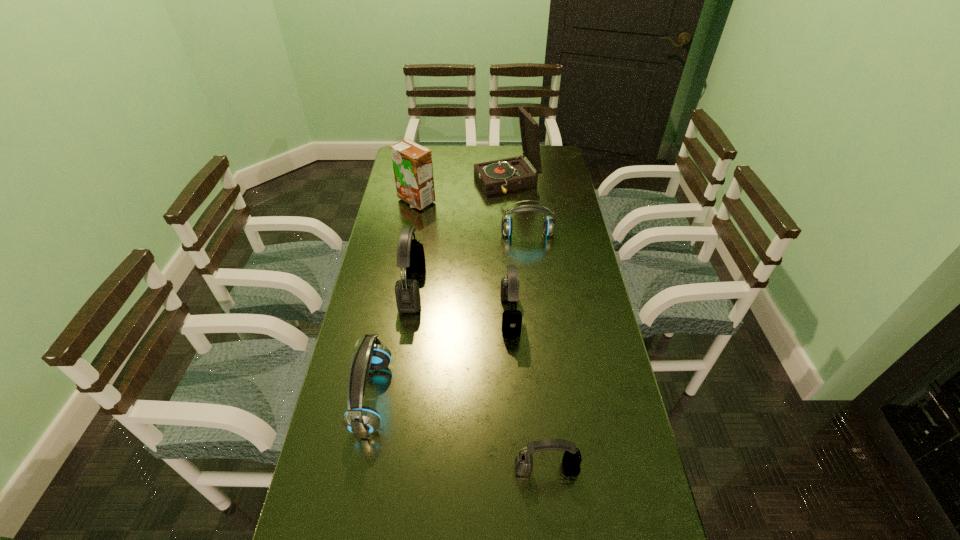
Where is `the nearest black headset`? The height and width of the screenshot is (540, 960). the nearest black headset is located at coordinates [x=571, y=461].

Identify the location of free space located on the back of the phonograph record. click(504, 150).

The width and height of the screenshot is (960, 540). I want to click on blank space located 0.240m on the straw side of the carton, so tap(407, 252).

Where is `vacant space positioned 0.280m on the headband of the tallest headset`? vacant space positioned 0.280m on the headband of the tallest headset is located at coordinates (508, 288).

At what (x,y) coordinates should I click in order to perform the action: click on vacant space located on the headband of the second biggest black headset. Please return your answer as a coordinate pair (x, y). Looking at the image, I should click on (406, 315).

The height and width of the screenshot is (540, 960). I want to click on vacant space located on the headband of the second biggest black headset, so click(x=399, y=315).

Identify the location of vacant region located on the headband of the second biggest black headset. (373, 315).

Image resolution: width=960 pixels, height=540 pixels. What are the coordinates of `free space located 0.080m on the ear cups of the nearer blue headset` in the screenshot? It's located at (419, 396).

Where is `blank space located on the ear cups of the farthest headset`? The height and width of the screenshot is (540, 960). blank space located on the ear cups of the farthest headset is located at coordinates (535, 293).

I want to click on free space located 0.120m on the headband of the nearest object, so click(x=554, y=535).